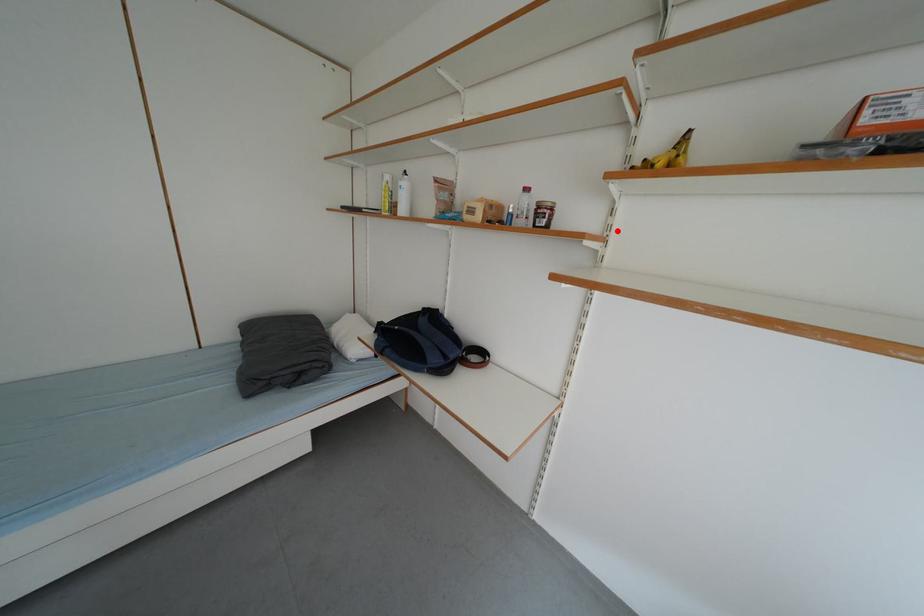
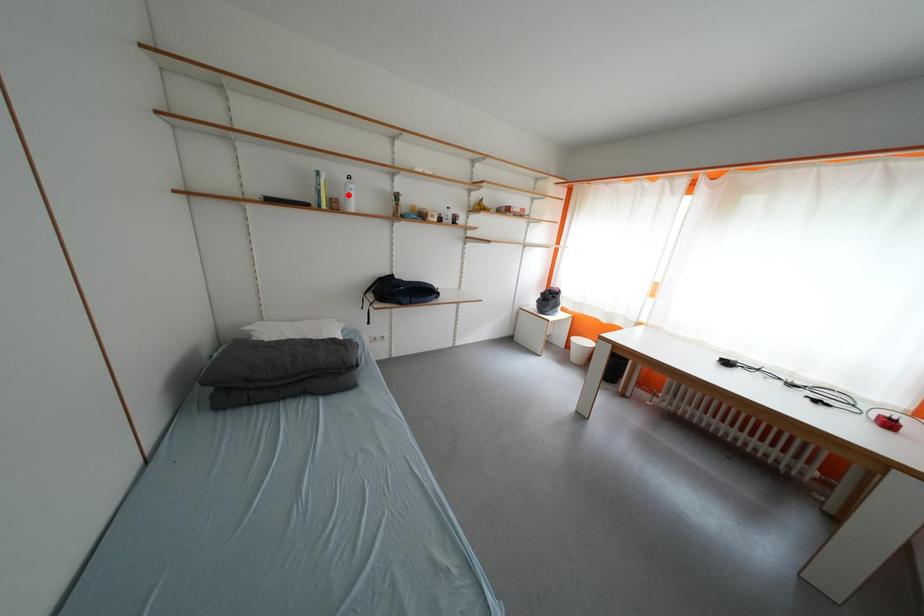
I am providing you with two images of the same scene from different viewpoints. A red point is marked on the first image and another point is marked on the second image. Do the highlighted points in image1 and image2 indicate the same real-world spot?

No